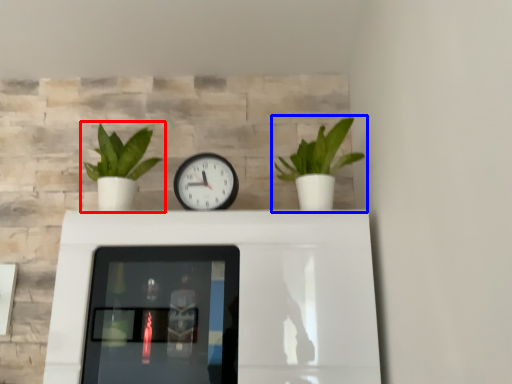
Question: Which of the following is the closest to the observer, houseplant (highlighted by a red box) or houseplant (highlighted by a blue box)?

Choices:
 (A) houseplant
 (B) houseplant

Answer: (B)